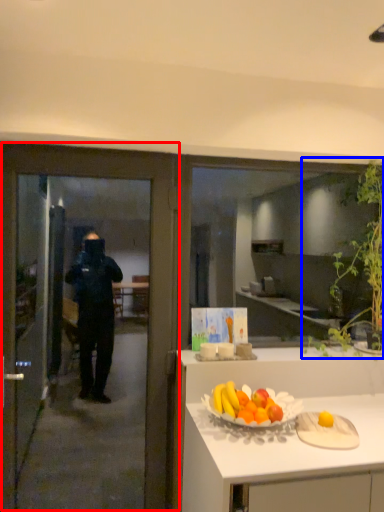
Question: Which of the following is the closest to the observer, door (highlighted by a red box) or plant (highlighted by a blue box)?

Choices:
 (A) door
 (B) plant

Answer: (A)